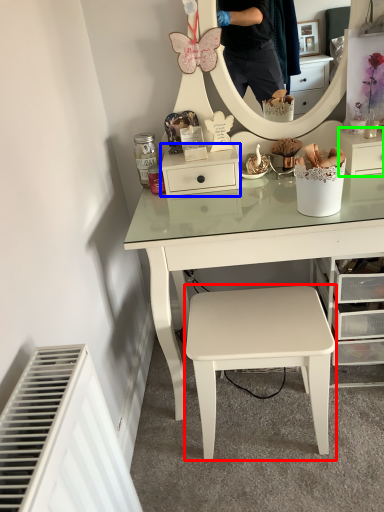
Question: Estimate the real-world distances between objects in this image. Which object is closer to stool (highlighted by a red box), shelf (highlighted by a blue box) or shelf (highlighted by a green box)?

Choices:
 (A) shelf
 (B) shelf

Answer: (A)